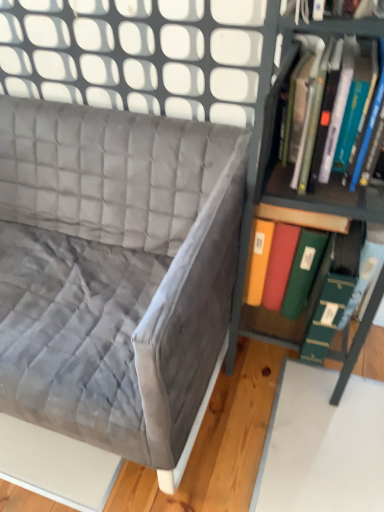
In order to face metallic green bookshelf at right, should I rotate leftwards or rightwards?

To align with it, rotate right about 16.770°.

In order to click on hardcover book at right, the second book in the bottom-to-top sequence in this screenshot , I will do `click(325, 115)`.

Considering the positions of objects metallic green bookshelf at right and green matte folder at right, acting as the first book starting from the bottom, in the image provided, who is more to the right, metallic green bookshelf at right or green matte folder at right, acting as the first book starting from the bottom,?

From the viewer's perspective, green matte folder at right, acting as the first book starting from the bottom, appears more on the right side.

In order to click on shelf that is in front of the green matte folder at right, the second book viewed from the top in this screenshot , I will do `click(290, 175)`.

Is metallic green bookshelf at right outside of green matte folder at right, the second book viewed from the top?

That's incorrect, metallic green bookshelf at right is not completely outside green matte folder at right, the second book viewed from the top.

Based on the photo, is metallic green bookshelf at right aimed at green matte folder at right, acting as the first book starting from the bottom?

Yes, metallic green bookshelf at right is oriented towards green matte folder at right, acting as the first book starting from the bottom.

Could you tell me if green matte folder at right, the second book viewed from the top, is facing velvet gray couch at upper left?

No, green matte folder at right, the second book viewed from the top, is not aimed at velvet gray couch at upper left.

Which object is positioned more to the left, green matte folder at right, the second book viewed from the top, or velvet gray couch at upper left?

velvet gray couch at upper left.

From a real-world perspective, is green matte folder at right, acting as the first book starting from the bottom, above or below velvet gray couch at upper left?

From a real-world perspective, green matte folder at right, acting as the first book starting from the bottom, is physically above velvet gray couch at upper left.

From the image's perspective, which is below, green matte folder at right, acting as the first book starting from the bottom, or velvet gray couch at upper left?

velvet gray couch at upper left appears lower in the image.

Considering the relative sizes of green matte folder at right, acting as the first book starting from the bottom, and metallic green bookshelf at right in the image provided, is green matte folder at right, acting as the first book starting from the bottom, taller than metallic green bookshelf at right?

No.

How many degrees apart are the facing directions of green matte folder at right, the second book viewed from the top, and metallic green bookshelf at right?

They differ by 0.718 degrees in their facing directions.

Which is more to the left, green matte folder at right, acting as the first book starting from the bottom, or metallic green bookshelf at right?

Positioned to the left is metallic green bookshelf at right.

Based on their sizes in the image, would you say green matte folder at right, acting as the first book starting from the bottom, is bigger or smaller than metallic green bookshelf at right?

Clearly, green matte folder at right, acting as the first book starting from the bottom, is smaller in size than metallic green bookshelf at right.

The width and height of the screenshot is (384, 512). I want to click on shelf located above the velvet gray couch at upper left (from a real-world perspective), so click(x=290, y=175).

Is velvet gray couch at upper left facing away from metallic green bookshelf at right?

velvet gray couch at upper left does not have its back to metallic green bookshelf at right.

Is velvet gray couch at upper left bigger than metallic green bookshelf at right?

Yes, velvet gray couch at upper left is bigger than metallic green bookshelf at right.

Is hardcover book at right, which ranks as the first book in top-to-bottom order, inside the boundaries of metallic green bookshelf at right, or outside?

hardcover book at right, which ranks as the first book in top-to-bottom order, is spatially positioned inside metallic green bookshelf at right.

From a real-world perspective, which object stands above the other?

hardcover book at right, the second book in the bottom-to-top sequence, is physically above.

Is hardcover book at right, which ranks as the first book in top-to-bottom order, in front of metallic green bookshelf at right?

No, hardcover book at right, which ranks as the first book in top-to-bottom order, is further to the viewer.

Could you tell me if hardcover book at right, the second book in the bottom-to-top sequence, is turned towards metallic green bookshelf at right?

Yes, hardcover book at right, the second book in the bottom-to-top sequence, is oriented towards metallic green bookshelf at right.

How far apart are metallic green bookshelf at right and velvet gray couch at upper left?

metallic green bookshelf at right and velvet gray couch at upper left are 15.10 inches apart from each other.

From the picture: Is the position of metallic green bookshelf at right less distant than that of velvet gray couch at upper left?

Yes, metallic green bookshelf at right is in front of velvet gray couch at upper left.

Is metallic green bookshelf at right bigger than velvet gray couch at upper left?

Incorrect, metallic green bookshelf at right is not larger than velvet gray couch at upper left.

Between point (289, 346) and point (138, 279), which one is positioned behind?

The point (138, 279) is farther from the camera.

Does point (333, 330) come closer to viewer compared to point (376, 93)?

No, it is behind (376, 93).

You are a GUI agent. You are given a task and a screenshot of the screen. Output one action in this format:
    pyautogui.click(x=<x>, y=<y>)
    Task: Click on the book to the left of green matte folder at right, the second book viewed from the top
    Image resolution: width=384 pixels, height=512 pixels.
    Given the screenshot: What is the action you would take?
    pyautogui.click(x=325, y=115)

Relative to hardcover book at right, which ranks as the first book in top-to-bottom order, is green matte folder at right, the second book viewed from the top, in front or behind?

green matte folder at right, the second book viewed from the top, is positioned farther from the viewer than hardcover book at right, which ranks as the first book in top-to-bottom order.

Considering the sizes of objects green matte folder at right, acting as the first book starting from the bottom, and hardcover book at right, which ranks as the first book in top-to-bottom order, in the image provided, who is wider, green matte folder at right, acting as the first book starting from the bottom, or hardcover book at right, which ranks as the first book in top-to-bottom order,?

green matte folder at right, acting as the first book starting from the bottom, is wider.

The height and width of the screenshot is (512, 384). I want to click on book below the metallic green bookshelf at right (from the image's perspective), so click(281, 313).

Starting from the velvet gray couch at upper left, which book is the 2nd one to the right? Please provide its 2D coordinates.

[(281, 313)]

Considering their positions, is green matte folder at right, acting as the first book starting from the bottom, positioned further to velvet gray couch at upper left than hardcover book at right, which ranks as the first book in top-to-bottom order?

green matte folder at right, acting as the first book starting from the bottom, is positioned further to the anchor velvet gray couch at upper left.

Based on their spatial positions, is velvet gray couch at upper left or metallic green bookshelf at right closer to hardcover book at right, which ranks as the first book in top-to-bottom order?

The object closer to hardcover book at right, which ranks as the first book in top-to-bottom order, is metallic green bookshelf at right.

From the image, which object appears to be nearer to green matte folder at right, the second book viewed from the top, velvet gray couch at upper left or hardcover book at right, which ranks as the first book in top-to-bottom order?

The object closer to green matte folder at right, the second book viewed from the top, is hardcover book at right, which ranks as the first book in top-to-bottom order.

From the image, which object appears to be farther from metallic green bookshelf at right, velvet gray couch at upper left or hardcover book at right, the second book in the bottom-to-top sequence?

velvet gray couch at upper left.

Looking at the image, which one is located further to velvet gray couch at upper left, hardcover book at right, which ranks as the first book in top-to-bottom order, or green matte folder at right, the second book viewed from the top?

The object further to velvet gray couch at upper left is green matte folder at right, the second book viewed from the top.

When comparing their distances from hardcover book at right, which ranks as the first book in top-to-bottom order, does green matte folder at right, acting as the first book starting from the bottom, or metallic green bookshelf at right seem closer?

metallic green bookshelf at right lies closer to hardcover book at right, which ranks as the first book in top-to-bottom order, than the other object.

In the scene shown: Which object lies nearer to the anchor point green matte folder at right, the second book viewed from the top, hardcover book at right, which ranks as the first book in top-to-bottom order, or metallic green bookshelf at right?

metallic green bookshelf at right.

Based on their spatial positions, is green matte folder at right, acting as the first book starting from the bottom, or velvet gray couch at upper left closer to hardcover book at right, the second book in the bottom-to-top sequence?

The object closer to hardcover book at right, the second book in the bottom-to-top sequence, is green matte folder at right, acting as the first book starting from the bottom.

Find the location of a particular element. The height and width of the screenshot is (512, 384). book situated between velvet gray couch at upper left and green matte folder at right, the second book viewed from the top, from left to right is located at coordinates (325, 115).

The width and height of the screenshot is (384, 512). Identify the location of shelf between velvet gray couch at upper left and green matte folder at right, the second book viewed from the top, in the horizontal direction. (290, 175).

This screenshot has height=512, width=384. In order to click on book positioned between metallic green bookshelf at right and green matte folder at right, acting as the first book starting from the bottom, from near to far in this screenshot , I will do `click(325, 115)`.

I want to click on book between velvet gray couch at upper left and metallic green bookshelf at right, so click(325, 115).